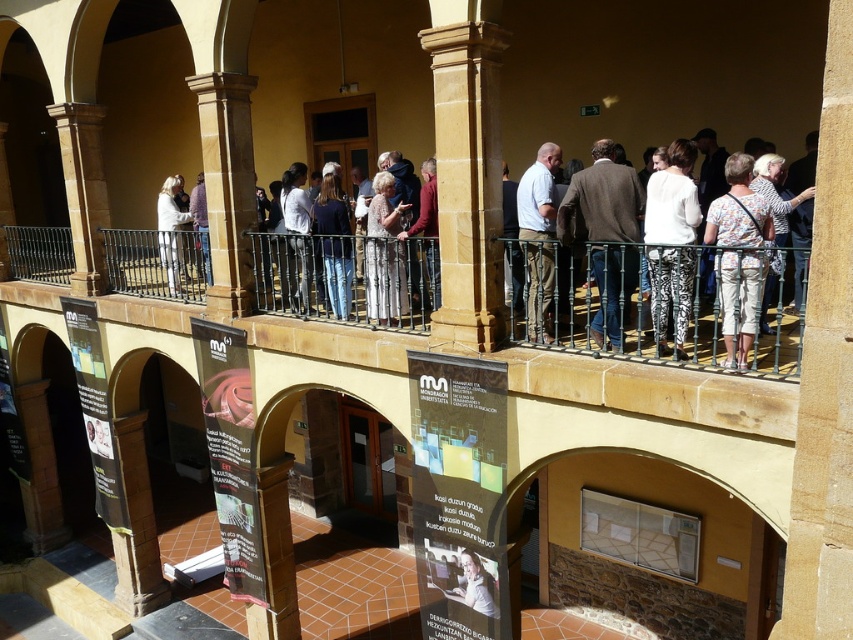
Question: Which object is farther from the camera taking this photo?

Choices:
 (A) white casual attire at center
 (B) brown stone pillar at center
 (C) floral-patterned pants at center

Answer: (B)

Question: Does black wrought iron railing at upper center appear on the right side of brown stone pillar at center?

Choices:
 (A) no
 (B) yes

Answer: (A)

Question: Which point is closer to the camera taking this photo?

Choices:
 (A) (292, 196)
 (B) (668, 305)
 (C) (260, 301)

Answer: (B)

Question: Which of the following is the closest to the observer?

Choices:
 (A) (163, 228)
 (B) (631, 353)

Answer: (B)

Question: Can you confirm if black wrought iron railing at upper center is thinner than white textured leggings at center?

Choices:
 (A) yes
 (B) no

Answer: (B)

Question: Considering the relative positions of floral-patterned pants at center and floral-patterned dress at center in the image provided, where is floral-patterned pants at center located with respect to floral-patterned dress at center?

Choices:
 (A) above
 (B) below

Answer: (B)